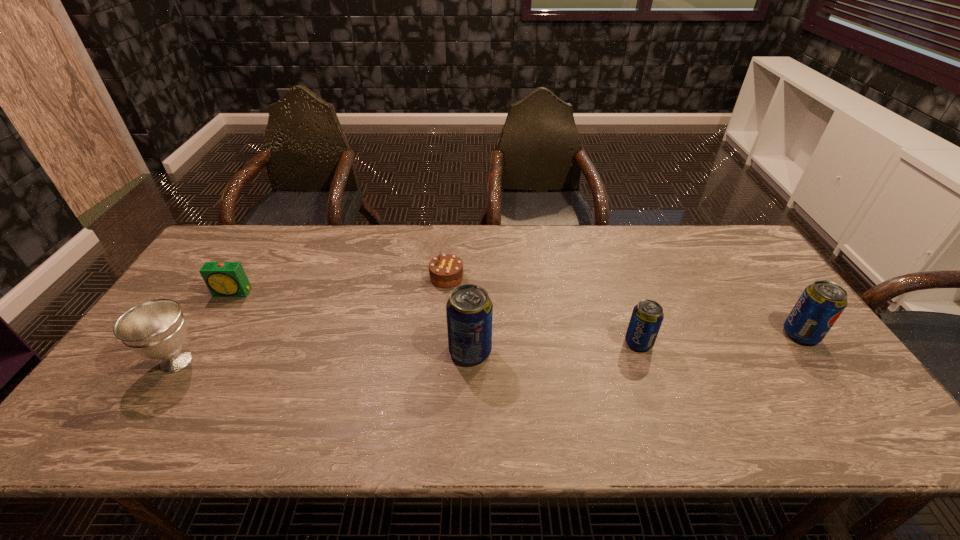
At what (x,y) coordinates should I click in order to perform the action: click on the leftmost soda. Please return your answer as a coordinate pair (x, y). The width and height of the screenshot is (960, 540). Looking at the image, I should click on (469, 310).

Where is `the tallest soda`? The height and width of the screenshot is (540, 960). the tallest soda is located at coordinates (469, 310).

Identify the location of the second object from right to left. The height and width of the screenshot is (540, 960). (647, 316).

Where is `the second soda from left to right`? The height and width of the screenshot is (540, 960). the second soda from left to right is located at coordinates (647, 316).

The height and width of the screenshot is (540, 960). In order to click on the rightmost object in this screenshot , I will do `click(821, 303)`.

Locate an element on the screen. Image resolution: width=960 pixels, height=540 pixels. the rightmost soda is located at coordinates (821, 303).

Locate an element on the screen. This screenshot has height=540, width=960. alarm clock is located at coordinates (224, 279).

In order to click on chocolate cake in this screenshot , I will do `click(446, 271)`.

Locate an element on the screen. This screenshot has width=960, height=540. chalice is located at coordinates (156, 329).

Locate an element on the screen. The height and width of the screenshot is (540, 960). vacant space located 0.100m on the left of the tallest soda is located at coordinates (410, 351).